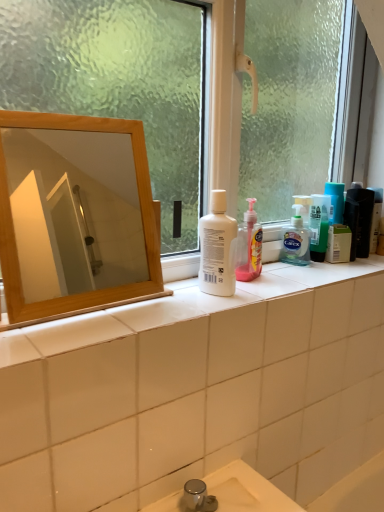
Question: Is white plastic bottle at center taller than matte black hair care product at right, the second toiletry when ordered from right to left?

Choices:
 (A) yes
 (B) no

Answer: (A)

Question: Can you confirm if white plastic bottle at center is smaller than matte black hair care product at right, the second toiletry when ordered from right to left?

Choices:
 (A) yes
 (B) no

Answer: (B)

Question: Does white plastic bottle at center have a greater width compared to matte black hair care product at right, acting as the 1th toiletry starting from the left?

Choices:
 (A) yes
 (B) no

Answer: (A)

Question: Considering the relative positions of white plastic bottle at center and matte black hair care product at right, the second toiletry when ordered from right to left, in the image provided, is white plastic bottle at center to the left of matte black hair care product at right, the second toiletry when ordered from right to left, from the viewer's perspective?

Choices:
 (A) yes
 (B) no

Answer: (A)

Question: Is white plastic bottle at center with matte black hair care product at right, acting as the 1th toiletry starting from the left?

Choices:
 (A) no
 (B) yes

Answer: (A)

Question: Is the position of white plastic bottle at center less distant than that of matte black hair care product at right, the second toiletry when ordered from right to left?

Choices:
 (A) yes
 (B) no

Answer: (A)

Question: Is wooden mirror at upper left at the left side of matte black hair care product at right, the second toiletry when ordered from right to left?

Choices:
 (A) no
 (B) yes

Answer: (B)

Question: Is wooden mirror at upper left to the right of matte black hair care product at right, acting as the 1th toiletry starting from the left, from the viewer's perspective?

Choices:
 (A) yes
 (B) no

Answer: (B)

Question: Is wooden mirror at upper left positioned before matte black hair care product at right, acting as the 1th toiletry starting from the left?

Choices:
 (A) no
 (B) yes

Answer: (B)

Question: Is wooden mirror at upper left bigger than matte black hair care product at right, acting as the 1th toiletry starting from the left?

Choices:
 (A) yes
 (B) no

Answer: (A)

Question: From a real-world perspective, is wooden mirror at upper left under matte black hair care product at right, the second toiletry when ordered from right to left?

Choices:
 (A) yes
 (B) no

Answer: (B)

Question: Can you confirm if wooden mirror at upper left is shorter than matte black hair care product at right, the second toiletry when ordered from right to left?

Choices:
 (A) no
 (B) yes

Answer: (A)

Question: Is translucent plastic bottle at right, the 2th toiletry positioned from the left, outside of white plastic bottle at center?

Choices:
 (A) no
 (B) yes

Answer: (B)